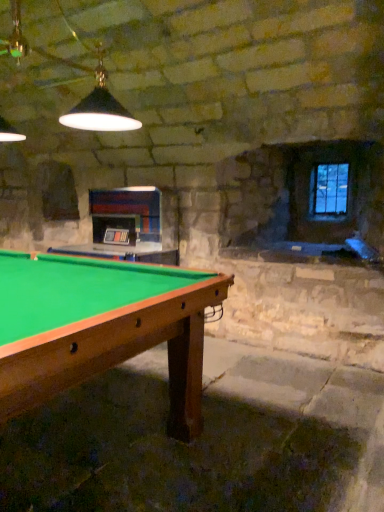
In order to face green felt pool table at center, should I rotate leftwards or rightwards?

You should look left and rotate roughly 24.467 degrees.

Locate an element on the screen. This screenshot has height=512, width=384. green felt pool table at center is located at coordinates (100, 327).

Describe the element at coordinates (100, 327) in the screenshot. I see `green felt pool table at center` at that location.

Where is `blue glass window at upper right`? blue glass window at upper right is located at coordinates (329, 189).

Image resolution: width=384 pixels, height=512 pixels. What do you see at coordinates (329, 189) in the screenshot?
I see `blue glass window at upper right` at bounding box center [329, 189].

Find the location of `green felt pool table at center`. green felt pool table at center is located at coordinates (100, 327).

From the picture: Can you confirm if blue glass window at upper right is positioned to the left of green felt pool table at center?

No, blue glass window at upper right is not to the left of green felt pool table at center.

Is blue glass window at upper right positioned behind green felt pool table at center?

Yes.

Which is closer, (344, 212) or (185, 388)?

Point (344, 212).

From the image's perspective, relative to green felt pool table at center, is blue glass window at upper right above or below?

blue glass window at upper right is situated higher than green felt pool table at center in the image.

From a real-world perspective, is blue glass window at upper right positioned above or below green felt pool table at center?

From a real-world perspective, blue glass window at upper right is physically above green felt pool table at center.

Does blue glass window at upper right have a lesser width compared to green felt pool table at center?

Indeed, blue glass window at upper right has a lesser width compared to green felt pool table at center.

Is blue glass window at upper right shorter than green felt pool table at center?

Yes, blue glass window at upper right is shorter than green felt pool table at center.

Which of these two, blue glass window at upper right or green felt pool table at center, is smaller?

With smaller size is blue glass window at upper right.

Is green felt pool table at center surrounded by blue glass window at upper right?

Actually, green felt pool table at center is outside blue glass window at upper right.

From the picture: Can you see blue glass window at upper right touching green felt pool table at center?

No, blue glass window at upper right is not with green felt pool table at center.

Is blue glass window at upper right oriented away from green felt pool table at center?

blue glass window at upper right is not turned away from green felt pool table at center.

Find the location of a particular element. window above the green felt pool table at center (from the image's perspective) is located at coordinates (329, 189).

Is green felt pool table at center to the left of blue glass window at upper right from the viewer's perspective?

Yes, green felt pool table at center is to the left of blue glass window at upper right.

Is the depth of green felt pool table at center less than that of blue glass window at upper right?

Yes, green felt pool table at center is closer to the camera.

From the picture: Which is nearer, (194, 377) or (327, 208)?

The point (194, 377) is closer to the camera.

In the scene shown: From the image's perspective, which is below, green felt pool table at center or blue glass window at upper right?

green felt pool table at center is shown below in the image.

From a real-world perspective, is green felt pool table at center below blue glass window at upper right?

Correct, in the physical world, green felt pool table at center is lower than blue glass window at upper right.

Is green felt pool table at center wider or thinner than blue glass window at upper right?

Clearly, green felt pool table at center has more width compared to blue glass window at upper right.

Considering the relative sizes of green felt pool table at center and blue glass window at upper right in the image provided, is green felt pool table at center shorter than blue glass window at upper right?

Incorrect, the height of green felt pool table at center does not fall short of that of blue glass window at upper right.

Which of these two, green felt pool table at center or blue glass window at upper right, is smaller?

Smaller between the two is blue glass window at upper right.

Would you say green felt pool table at center is outside blue glass window at upper right?

Yes, green felt pool table at center is located beyond the bounds of blue glass window at upper right.

Is there a large distance between green felt pool table at center and blue glass window at upper right?

That's right, there is a large distance between green felt pool table at center and blue glass window at upper right.

Does green felt pool table at center turn towards blue glass window at upper right?

No, green felt pool table at center is not aimed at blue glass window at upper right.

I want to click on window above the green felt pool table at center (from the image's perspective), so click(329, 189).

Where is `window behind the green felt pool table at center`? The image size is (384, 512). window behind the green felt pool table at center is located at coordinates (329, 189).

You are a GUI agent. You are given a task and a screenshot of the screen. Output one action in this format:
    pyautogui.click(x=<x>, y=<y>)
    Task: Click on the billiard table directly beneath the blue glass window at upper right (from a real-world perspective)
    
    Given the screenshot: What is the action you would take?
    pyautogui.click(x=100, y=327)